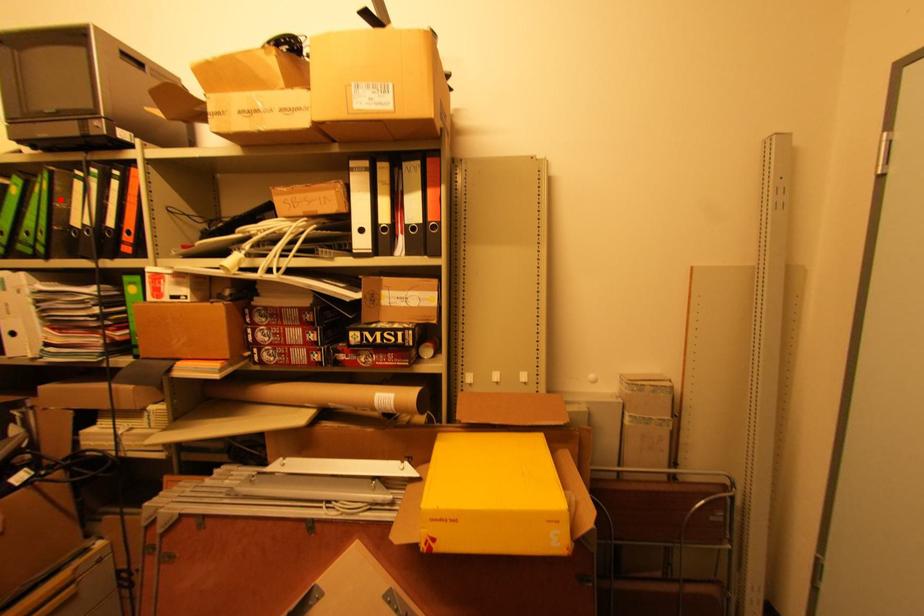
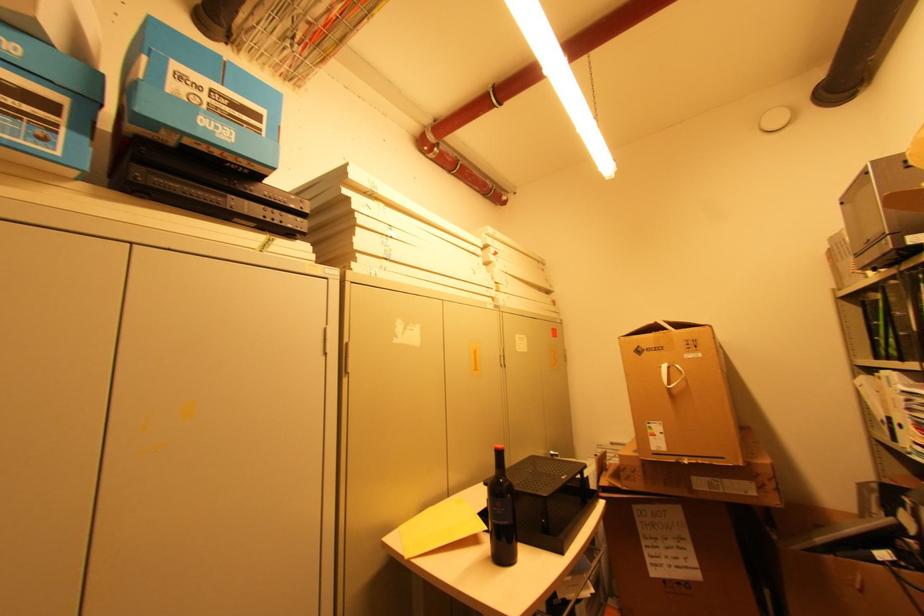
Question: I am providing you with two images of the same scene from different viewpoints. Given a red point in image1, look at the same physical point in image2. Is it:

Choices:
 (A) Closer to the viewpoint
 (B) Farther from the viewpoint

Answer: (A)